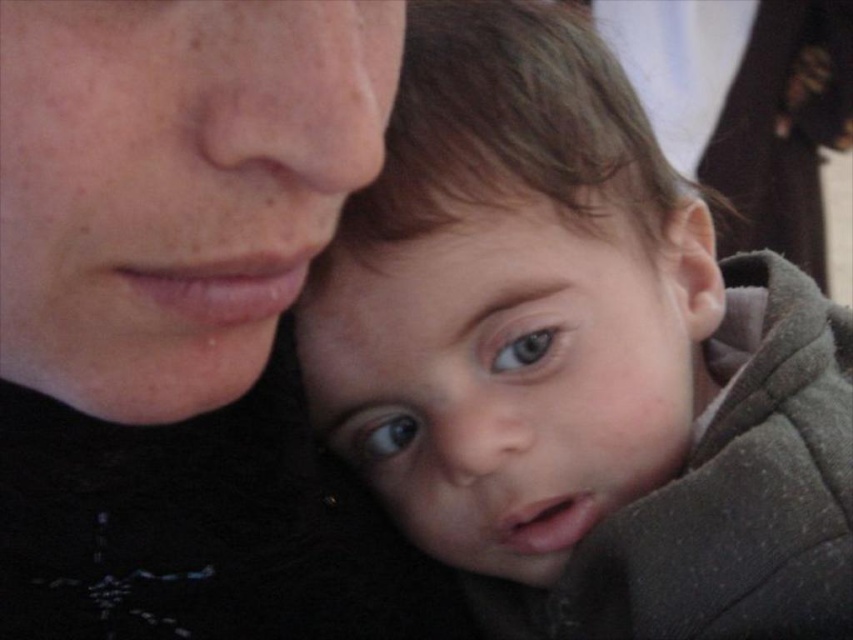
Question: Does matte black face at upper left appear over green matte eye at center?

Choices:
 (A) yes
 (B) no

Answer: (B)

Question: Which point is closer to the camera taking this photo?

Choices:
 (A) (361, 460)
 (B) (229, 621)
 (C) (514, 349)

Answer: (C)

Question: Which point appears farthest from the camera in this image?

Choices:
 (A) (740, 580)
 (B) (506, 365)
 (C) (140, 266)

Answer: (B)

Question: Is matte black face at upper left below brown glossy eye at center?

Choices:
 (A) no
 (B) yes

Answer: (A)

Question: Among these objects, which one is nearest to the camera?

Choices:
 (A) matte black face at upper left
 (B) smooth brown hair at center
 (C) green matte eye at center
 (D) brown glossy eye at center

Answer: (A)

Question: Does matte black face at upper left appear under brown glossy eye at center?

Choices:
 (A) no
 (B) yes

Answer: (A)